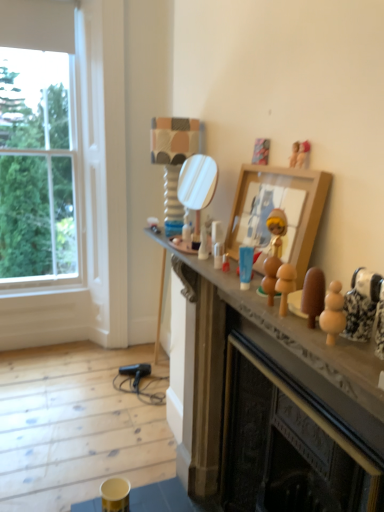
The height and width of the screenshot is (512, 384). I want to click on wooden figurine at upper center, arranged as the 3th toy when viewed from the right, so click(294, 154).

Looking at this image, what is the approximate height of translucent plastic container at center, the 3th toy positioned from the bottom?

The height of translucent plastic container at center, the 3th toy positioned from the bottom, is 5.33 inches.

Where is `translucent plastic container at center, positioned as the third toy in top-to-bottom order`? translucent plastic container at center, positioned as the third toy in top-to-bottom order is located at coordinates click(x=203, y=244).

In order to face wooden toy at center, which appears as the fourth toy when viewed from the back, should I rotate leftwards or rightwards?

It's best to rotate right around 10.602 degrees.

In order to face porcelain figurine at right, the 1th toy in the right-to-left sequence, should I rotate leftwards or rightwards?

You should look right and rotate roughly 24.941 degrees.

You are a GUI agent. You are given a task and a screenshot of the screen. Output one action in this format:
    pyautogui.click(x=<x>, y=<y>)
    Task: Click on the wooden doll at upper right, the second toy when ordered from top to bottom
    Image resolution: width=384 pixels, height=512 pixels.
    Given the screenshot: What is the action you would take?
    pyautogui.click(x=303, y=154)

At what (x,y) coordinates should I click in order to perform the action: click on wooden figurine at upper center, the fourth toy when ordered from front to back. Please return your answer as a coordinate pair (x, y). The width and height of the screenshot is (384, 512). Looking at the image, I should click on (294, 154).

From the image's perspective, is wooden toy at center, marked as the 2th toy in a front-to-back arrangement, above or below wooden figurines at center?

Clearly, from the image's perspective, wooden toy at center, marked as the 2th toy in a front-to-back arrangement, is above wooden figurines at center.

Based on the photo, is wooden toy at center, placed as the 4th toy when sorted from top to bottom, not close to wooden figurines at center?

That's not correct — wooden toy at center, placed as the 4th toy when sorted from top to bottom, is a little close to wooden figurines at center.

Which of these two, wooden toy at center, placed as the 4th toy when sorted from top to bottom, or wooden figurines at center, stands shorter?

wooden toy at center, placed as the 4th toy when sorted from top to bottom, is shorter.

Considering the sizes of objects wooden toy at center, acting as the second toy starting from the left, and wooden figurines at center in the image provided, who is bigger, wooden toy at center, acting as the second toy starting from the left, or wooden figurines at center?

wooden figurines at center.

From a real-world perspective, is translucent plastic container at center, the 3th toy positioned from the bottom, located beneath clear glass window at left?

Indeed, from a real-world perspective, translucent plastic container at center, the 3th toy positioned from the bottom, is positioned beneath clear glass window at left.

Can you confirm if translucent plastic container at center, the 3th toy positioned from the bottom, is wider than clear glass window at left?

No, translucent plastic container at center, the 3th toy positioned from the bottom, is not wider than clear glass window at left.

Could you tell me if translucent plastic container at center, which is the fifth toy from right to left, is turned towards clear glass window at left?

No.

Does translucent plastic container at center, positioned as the third toy in top-to-bottom order, touch clear glass window at left?

No.

Where is `mantle beneath the wooden toy at center, acting as the second toy starting from the left (from a real-world perspective)`? mantle beneath the wooden toy at center, acting as the second toy starting from the left (from a real-world perspective) is located at coordinates (271, 401).

From the image's perspective, would you say wooden figurines at center is shown under wooden toy at center, placed as the 4th toy when sorted from top to bottom?

Indeed, from the image's perspective, wooden figurines at center is shown beneath wooden toy at center, placed as the 4th toy when sorted from top to bottom.

Which of these two, wooden figurines at center or wooden toy at center, the fourth toy viewed from the right, is smaller?

Smaller between the two is wooden toy at center, the fourth toy viewed from the right.

Can you confirm if wooden figurines at center is positioned to the left of wooden toy at center, placed as the 4th toy when sorted from top to bottom?

In fact, wooden figurines at center is to the right of wooden toy at center, placed as the 4th toy when sorted from top to bottom.

From a real-world perspective, is wooden figurines at center below clear glass window at left?

Yes, from a real-world perspective, wooden figurines at center is below clear glass window at left.

Is wooden figurines at center not within clear glass window at left?

That's correct, wooden figurines at center is outside of clear glass window at left.

Can you confirm if wooden figurines at center is shorter than clear glass window at left?

Correct, wooden figurines at center is not as tall as clear glass window at left.

Would you say wooden figurines at center is a long distance from clear glass window at left?

Yes.

Is the depth of porcelain figurine at right, placed as the 5th toy when sorted from top to bottom, greater than that of wooden figurine at upper center, the 5th toy when ordered from bottom to top?

No, porcelain figurine at right, placed as the 5th toy when sorted from top to bottom, is closer to the camera.

Which is more to the right, porcelain figurine at right, placed as the 5th toy when sorted from top to bottom, or wooden figurine at upper center, the fourth toy when ordered from front to back?

porcelain figurine at right, placed as the 5th toy when sorted from top to bottom, is more to the right.

Is porcelain figurine at right, which appears as the first toy when viewed from the front, far away from wooden figurine at upper center, the first toy viewed from the top?

No, porcelain figurine at right, which appears as the first toy when viewed from the front, is in close proximity to wooden figurine at upper center, the first toy viewed from the top.

Which point is more forward, (296, 145) or (274, 262)?

The point (274, 262) is more forward.

Are wooden figurine at upper center, arranged as the 3th toy when viewed from the right, and wooden toy at center, placed as the 4th toy when sorted from top to bottom, making contact?

No, wooden figurine at upper center, arranged as the 3th toy when viewed from the right, is not with wooden toy at center, placed as the 4th toy when sorted from top to bottom.

From the image's perspective, is wooden figurine at upper center, the second toy when ordered from back to front, beneath wooden toy at center, the fourth toy viewed from the right?

Actually, wooden figurine at upper center, the second toy when ordered from back to front, appears above wooden toy at center, the fourth toy viewed from the right, in the image.

Does wooden picture frame at upper center have a larger size compared to wooden figurine at upper center, the fourth toy when ordered from front to back?

Yes, wooden picture frame at upper center is bigger than wooden figurine at upper center, the fourth toy when ordered from front to back.

From the image's perspective, is wooden picture frame at upper center located beneath wooden figurine at upper center, which appears as the 3th toy when viewed from the left?

Indeed, from the image's perspective, wooden picture frame at upper center is shown beneath wooden figurine at upper center, which appears as the 3th toy when viewed from the left.

Consider the image. Can you tell me how much wooden picture frame at upper center and wooden figurine at upper center, which appears as the 3th toy when viewed from the left, differ in facing direction?

0.00472 degrees separate the facing orientations of wooden picture frame at upper center and wooden figurine at upper center, which appears as the 3th toy when viewed from the left.

In the image, is wooden picture frame at upper center positioned in front of or behind wooden figurine at upper center, arranged as the 3th toy when viewed from the right?

Clearly, wooden picture frame at upper center is in front of wooden figurine at upper center, arranged as the 3th toy when viewed from the right.

Image resolution: width=384 pixels, height=512 pixels. I want to click on mantle on the right of wooden toy at center, which appears as the fourth toy when viewed from the back, so click(x=271, y=401).

The height and width of the screenshot is (512, 384). Identify the location of the 1st toy in front of the clear glass window at left, starting your count from the anchor. (203, 244).

Considering their positions, is wooden toy at center, the second toy ordered from the bottom, positioned closer to wooden figurines at center than wooden doll at upper right, marked as the third toy in a back-to-front arrangement?

wooden toy at center, the second toy ordered from the bottom, is closer to wooden figurines at center.

When comparing their distances from wooden doll at upper right, marked as the third toy in a back-to-front arrangement, does translucent plastic container at center, which is the 1th toy in left-to-right order, or wooden figurines at center seem further?

Based on the image, wooden figurines at center appears to be further to wooden doll at upper right, marked as the third toy in a back-to-front arrangement.

Based on their spatial positions, is wooden toy at center, the second toy ordered from the bottom, or wooden figurines at center further from wooden figurine at upper center, the fourth toy when ordered from front to back?

Based on the image, wooden figurines at center appears to be further to wooden figurine at upper center, the fourth toy when ordered from front to back.

Looking at the image, which one is located closer to wooden picture frame at upper center, porcelain figurine at right, placed as the 5th toy when sorted from top to bottom, or wooden toy at center, the fourth toy viewed from the right?

Among the two, wooden toy at center, the fourth toy viewed from the right, is located nearer to wooden picture frame at upper center.

When comparing their distances from wooden figurines at center, does translucent plastic container at center, positioned as the third toy in top-to-bottom order, or wooden picture frame at upper center seem further?

translucent plastic container at center, positioned as the third toy in top-to-bottom order, is further to wooden figurines at center.

Looking at the image, which one is located closer to clear glass window at left, wooden figurines at center or wooden doll at upper right, the fourth toy when ordered from bottom to top?

Based on the image, wooden figurines at center appears to be nearer to clear glass window at left.

Considering their positions, is wooden figurine at upper center, the first toy viewed from the top, positioned closer to wooden picture frame at upper center than porcelain figurine at right, which is the 5th toy in back-to-front order?

The object closer to wooden picture frame at upper center is wooden figurine at upper center, the first toy viewed from the top.

In the scene shown: Estimate the real-world distances between objects in this image. Which object is closer to wooden toy at center, the second toy ordered from the bottom, wooden picture frame at upper center or translucent plastic container at center, which is the 1th toy in left-to-right order?

wooden picture frame at upper center is closer to wooden toy at center, the second toy ordered from the bottom.

The image size is (384, 512). Find the location of `toy located between porcelain figurine at right, the 1th toy in the right-to-left sequence, and wooden doll at upper right, the second toy when ordered from top to bottom, in the depth direction`. toy located between porcelain figurine at right, the 1th toy in the right-to-left sequence, and wooden doll at upper right, the second toy when ordered from top to bottom, in the depth direction is located at coordinates (270, 277).

Locate an element on the screen. picture frame between porcelain figurine at right, which appears as the first toy when viewed from the front, and wooden doll at upper right, marked as the third toy in a back-to-front arrangement, from front to back is located at coordinates (279, 207).

The height and width of the screenshot is (512, 384). I want to click on toy between wooden figurine at upper center, the first toy viewed from the top, and wooden picture frame at upper center vertically, so click(303, 154).

In order to click on toy located between wooden figurine at upper center, arranged as the 3th toy when viewed from the right, and clear glass window at left in the depth direction in this screenshot , I will do `click(203, 244)`.